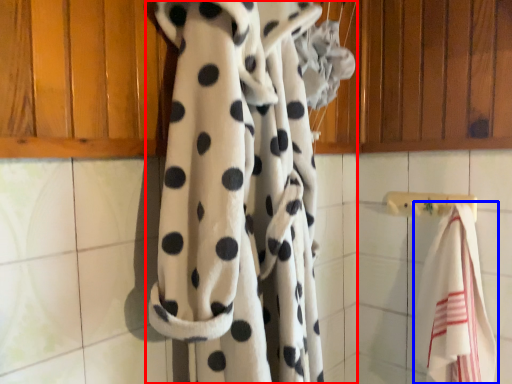
Question: Which of the following is the closest to the observer, curtain (highlighted by a red box) or towel (highlighted by a blue box)?

Choices:
 (A) curtain
 (B) towel

Answer: (A)